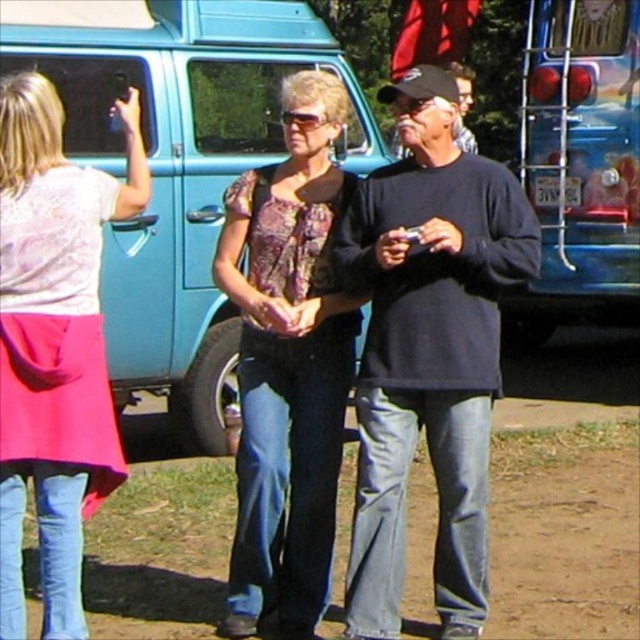
You are a photographer taking a picture of the black cotton shirt at center and the pink fabric skirt at left. Which one is positioned lower in the frame?

The black cotton shirt at center is positioned lower in the frame than the pink fabric skirt at left.

You are a photographer setting up a tripod to take a group photo of the teal matte van at center and the pink fabric skirt at left. To ensure both are in focus, you need to know which object is closer to the camera. Which one is closer?

The teal matte van at center is positioned over the pink fabric skirt at left, meaning it is closer to the camera.